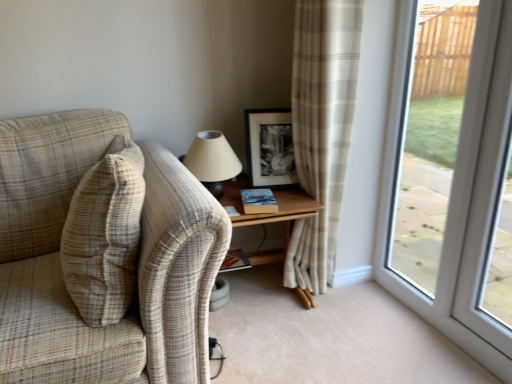
Measure the distance between beige plaid pillow at left and camera.

They are 3.51 feet apart.

Locate an element on the screen. This screenshot has height=384, width=512. wooden table at center is located at coordinates (270, 216).

At what (x,y) coordinates should I click in order to perform the action: click on transparent glass window at right. Please return your answer as a coordinate pair (x, y). This screenshot has height=384, width=512. Looking at the image, I should click on (451, 169).

Describe the element at coordinates (234, 261) in the screenshot. The image size is (512, 384). I see `hardcover book at center, placed as the 2th book when sorted from front to back` at that location.

This screenshot has height=384, width=512. What are the coordinates of `plaid fabric couch at left` in the screenshot? It's located at (x=102, y=255).

From the image's perspective, is wooden table at center above black matte picture frame at upper center?

No, from the image's perspective, wooden table at center is not above black matte picture frame at upper center.

From a real-world perspective, is wooden table at center over black matte picture frame at upper center?

Incorrect, from a real-world perspective, wooden table at center is lower than black matte picture frame at upper center.

Which of these two, wooden table at center or black matte picture frame at upper center, stands taller?

With more height is wooden table at center.

Are wooden table at center and matte beige lampshade at upper center making contact?

No, wooden table at center is not with matte beige lampshade at upper center.

From the image's perspective, is wooden table at center located above or below matte beige lampshade at upper center?

wooden table at center is below matte beige lampshade at upper center.

Image resolution: width=512 pixels, height=384 pixels. In the image, there is a matte beige lampshade at upper center. What are the coordinates of `table below it (from a real-world perspective)` in the screenshot? It's located at (270, 216).

Considering the positions of objects wooden table at center and matte beige lampshade at upper center in the image provided, who is in front, wooden table at center or matte beige lampshade at upper center?

Positioned in front is wooden table at center.

Is transparent glass screen door at right taller or shorter than black matte picture frame at upper center?

Considering their sizes, transparent glass screen door at right has more height than black matte picture frame at upper center.

Is transparent glass screen door at right facing away from black matte picture frame at upper center?

transparent glass screen door at right is not turned away from black matte picture frame at upper center.

Image resolution: width=512 pixels, height=384 pixels. What are the coordinates of `screen door on the right side of black matte picture frame at upper center` in the screenshot? It's located at (484, 167).

Based on the photo, how many degrees apart are the facing directions of transparent glass screen door at right and black matte picture frame at upper center?

The facing directions of transparent glass screen door at right and black matte picture frame at upper center are 79.3 degrees apart.

Is black matte picture frame at upper center positioned with its back to wooden table at center?

No, black matte picture frame at upper center is not facing away from wooden table at center.

Which object is further away from the camera, black matte picture frame at upper center or wooden table at center?

Positioned behind is black matte picture frame at upper center.

Can you confirm if black matte picture frame at upper center is bigger than wooden table at center?

No.

Who is taller, black matte picture frame at upper center or wooden table at center?

With more height is wooden table at center.

Is the position of transparent glass window at right more distant than that of transparent glass screen door at right?

No, transparent glass window at right is in front of transparent glass screen door at right.

Measure the distance from transparent glass window at right to transparent glass screen door at right.

8.53 inches.

Which of these two, transparent glass window at right or transparent glass screen door at right, stands taller?

With more height is transparent glass window at right.

From the image's perspective, does transparent glass window at right appear lower than transparent glass screen door at right?

Incorrect, from the image's perspective, transparent glass window at right is higher than transparent glass screen door at right.

Is hardcover book at center, the 2th book ordered from the bottom, turned away from plaid fabric couch at left?

No.

Which of these two, hardcover book at center, which appears as the 1th book when viewed from the right, or plaid fabric couch at left, is smaller?

hardcover book at center, which appears as the 1th book when viewed from the right, is smaller.

How many degrees apart are the facing directions of hardcover book at center, the second book viewed from the left, and plaid fabric couch at left?

hardcover book at center, the second book viewed from the left, and plaid fabric couch at left are facing 15.4 degrees away from each other.

Which is more to the right, hardcover book at center, which is the first book from top to bottom, or plaid fabric couch at left?

Positioned to the right is hardcover book at center, which is the first book from top to bottom.

Which is more to the left, hardcover book at center, the first book from the bottom, or plaid fabric couch at left?

plaid fabric couch at left is more to the left.

Based on the photo, between hardcover book at center, the second book when ordered from right to left, and plaid fabric couch at left, which one has larger width?

plaid fabric couch at left.

Is hardcover book at center, which ranks as the 1th book in left-to-right order, beside plaid fabric couch at left?

No, hardcover book at center, which ranks as the 1th book in left-to-right order, is not with plaid fabric couch at left.

Considering the sizes of objects hardcover book at center, which ranks as the 1th book in left-to-right order, and plaid fabric couch at left in the image provided, who is shorter, hardcover book at center, which ranks as the 1th book in left-to-right order, or plaid fabric couch at left?

hardcover book at center, which ranks as the 1th book in left-to-right order, is shorter.

This screenshot has height=384, width=512. In order to click on table on the left of black matte picture frame at upper center in this screenshot , I will do `click(270, 216)`.

Where is `table that is below the matte beige lampshade at upper center (from the image's perspective)`? table that is below the matte beige lampshade at upper center (from the image's perspective) is located at coordinates (270, 216).

Based on their spatial positions, is plaid fabric couch at left or transparent glass window at right further from black matte picture frame at upper center?

plaid fabric couch at left is positioned further to the anchor black matte picture frame at upper center.

Consider the image. When comparing their distances from hardcover book at center, arranged as the second book when viewed from the back, does beige plaid pillow at left or beige plaid curtain at center seem further?

beige plaid pillow at left is positioned further to the anchor hardcover book at center, arranged as the second book when viewed from the back.

Estimate the real-world distances between objects in this image. Which object is further from transparent glass screen door at right, beige plaid pillow at left or matte beige lampshade at upper center?

beige plaid pillow at left is positioned further to the anchor transparent glass screen door at right.

Which object lies further to the anchor point wooden table at center, beige plaid pillow at left or matte beige lampshade at upper center?

beige plaid pillow at left is positioned further to the anchor wooden table at center.

From the picture: Considering their positions, is black matte picture frame at upper center positioned closer to hardcover book at center, marked as the 1th book in a front-to-back arrangement, than plaid fabric couch at left?

black matte picture frame at upper center lies closer to hardcover book at center, marked as the 1th book in a front-to-back arrangement, than the other object.

Considering their positions, is beige plaid curtain at center positioned closer to wooden table at center than plaid fabric couch at left?

beige plaid curtain at center lies closer to wooden table at center than the other object.

Based on their spatial positions, is beige plaid pillow at left or hardcover book at center, the second book viewed from the left, closer to plaid fabric couch at left?

Based on the image, beige plaid pillow at left appears to be nearer to plaid fabric couch at left.

Estimate the real-world distances between objects in this image. Which object is further from black matte picture frame at upper center, plaid fabric couch at left or transparent glass screen door at right?

The object further to black matte picture frame at upper center is plaid fabric couch at left.

Image resolution: width=512 pixels, height=384 pixels. In order to click on table positioned between beige plaid pillow at left and hardcover book at center, the 1th book from the back, from near to far in this screenshot , I will do pos(270,216).

Find the location of `window between beige plaid curtain at center and transparent glass screen door at right in the horizontal direction`. window between beige plaid curtain at center and transparent glass screen door at right in the horizontal direction is located at coordinates (451, 169).

The width and height of the screenshot is (512, 384). In order to click on curtain between hardcover book at center, marked as the 2th book in a top-to-bottom arrangement, and transparent glass window at right, in the horizontal direction in this screenshot , I will do `click(321, 130)`.

Find the location of `curtain that lies between black matte picture frame at upper center and wooden table at center from top to bottom`. curtain that lies between black matte picture frame at upper center and wooden table at center from top to bottom is located at coordinates (321, 130).